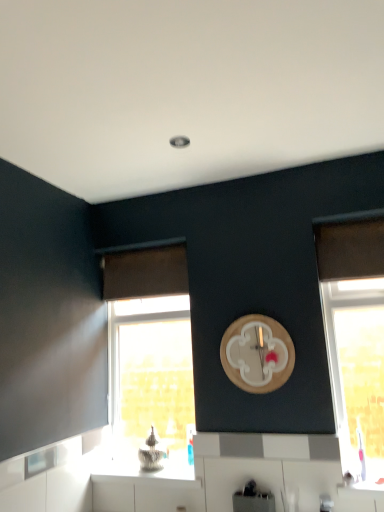
The width and height of the screenshot is (384, 512). Describe the element at coordinates (257, 354) in the screenshot. I see `wooden clock at upper center` at that location.

Image resolution: width=384 pixels, height=512 pixels. Describe the element at coordinates (145, 272) in the screenshot. I see `brown fabric curtain at upper left` at that location.

The height and width of the screenshot is (512, 384). Describe the element at coordinates (142, 473) in the screenshot. I see `white glossy countertop at lower center` at that location.

You are a GUI agent. You are given a task and a screenshot of the screen. Output one action in this format:
    pyautogui.click(x=<x>, y=<y>)
    Task: Click on the clear glass window at lower left, positioned as the first window in left-to-right order
    
    Given the screenshot: What is the action you would take?
    pyautogui.click(x=150, y=354)

This screenshot has width=384, height=512. Describe the element at coordinates (150, 354) in the screenshot. I see `clear glass window at lower left, which appears as the second window when viewed from the right` at that location.

Locate an element on the screen. This screenshot has height=512, width=384. translucent glass window at right, the 1th window in the front-to-back sequence is located at coordinates (355, 342).

Which object is wider, brown fabric curtain at upper left or wooden clock at upper center?

brown fabric curtain at upper left is wider.

How many degrees apart are the facing directions of brown fabric curtain at upper left and wooden clock at upper center?

They differ by 0.329 degrees in their facing directions.

Does brown fabric curtain at upper left appear on the right side of wooden clock at upper center?

No, brown fabric curtain at upper left is not to the right of wooden clock at upper center.

Is brown fabric curtain at upper left next to wooden clock at upper center and touching it?

No, brown fabric curtain at upper left is not next to wooden clock at upper center.

Is white glossy countertop at lower center bigger than metallic silver toaster at lower center?

Yes, white glossy countertop at lower center is bigger than metallic silver toaster at lower center.

Between white glossy countertop at lower center and metallic silver toaster at lower center, which one has larger width?

Wider between the two is white glossy countertop at lower center.

In terms of height, does white glossy countertop at lower center look taller or shorter compared to metallic silver toaster at lower center?

Clearly, white glossy countertop at lower center is shorter compared to metallic silver toaster at lower center.

From the image's perspective, is white glossy countertop at lower center located beneath metallic silver toaster at lower center?

Yes, from the image's perspective, white glossy countertop at lower center is below metallic silver toaster at lower center.

Considering the positions of point (358, 318) and point (167, 471), is point (358, 318) closer or farther from the camera than point (167, 471)?

Point (358, 318) is positioned closer to the camera compared to point (167, 471).

Which object is thinner, translucent glass window at right, the 1th window in the front-to-back sequence, or white glossy countertop at lower center?

With smaller width is translucent glass window at right, the 1th window in the front-to-back sequence.

Would you consider translucent glass window at right, acting as the 2th window starting from the back, to be distant from white glossy countertop at lower center?

Yes, translucent glass window at right, acting as the 2th window starting from the back, and white glossy countertop at lower center are located far from each other.

Who is bigger, translucent glass window at right, acting as the 2th window starting from the back, or white glossy countertop at lower center?

translucent glass window at right, acting as the 2th window starting from the back.

Between clear glass window at lower left, the second window positioned from the front, and metallic silver toaster at lower center, which one has larger size?

clear glass window at lower left, the second window positioned from the front, is bigger.

Considering the relative sizes of clear glass window at lower left, the second window positioned from the front, and metallic silver toaster at lower center in the image provided, is clear glass window at lower left, the second window positioned from the front, wider than metallic silver toaster at lower center?

No, clear glass window at lower left, the second window positioned from the front, is not wider than metallic silver toaster at lower center.

From a real-world perspective, is clear glass window at lower left, which appears as the second window when viewed from the right, below metallic silver toaster at lower center?

Incorrect, from a real-world perspective, clear glass window at lower left, which appears as the second window when viewed from the right, is higher than metallic silver toaster at lower center.

Is clear glass window at lower left, positioned as the first window in left-to-right order, looking in the opposite direction of metallic silver toaster at lower center?

That's not correct — clear glass window at lower left, positioned as the first window in left-to-right order, is not looking away from metallic silver toaster at lower center.

Is clear glass window at lower left, marked as the first window in a back-to-front arrangement, oriented away from brown fabric curtain at upper left?

No.

Between clear glass window at lower left, the second window positioned from the front, and brown fabric curtain at upper left, which one has smaller width?

Thinner between the two is brown fabric curtain at upper left.

Can you confirm if clear glass window at lower left, marked as the first window in a back-to-front arrangement, is positioned to the right of brown fabric curtain at upper left?

Yes.

Considering the sizes of clear glass window at lower left, positioned as the first window in left-to-right order, and brown fabric curtain at upper left in the image, is clear glass window at lower left, positioned as the first window in left-to-right order, taller or shorter than brown fabric curtain at upper left?

→ Clearly, clear glass window at lower left, positioned as the first window in left-to-right order, is taller compared to brown fabric curtain at upper left.

From the picture: From the image's perspective, is white glossy countertop at lower center located beneath translucent glass window at right, the first window in the right-to-left sequence?

Yes.

Identify the location of counter top on the left side of translucent glass window at right, acting as the 2th window starting from the back. The image size is (384, 512). (142, 473).

Is white glossy countertop at lower center facing towards translucent glass window at right, acting as the 2th window starting from the back?

No, white glossy countertop at lower center is not oriented towards translucent glass window at right, acting as the 2th window starting from the back.

There is a translucent glass window at right, the 1th window in the front-to-back sequence. Identify the location of curtain above it (from a real-world perspective). [x=145, y=272].

Which of these two, brown fabric curtain at upper left or translucent glass window at right, the 1th window in the front-to-back sequence, is wider?

translucent glass window at right, the 1th window in the front-to-back sequence.

How different are the orientations of brown fabric curtain at upper left and translucent glass window at right, the second window in the left-to-right sequence, in degrees?

The facing directions of brown fabric curtain at upper left and translucent glass window at right, the second window in the left-to-right sequence, are 0.328 degrees apart.

I want to click on clock below the brown fabric curtain at upper left (from the image's perspective), so (x=257, y=354).

I want to click on appliance above the white glossy countertop at lower center (from the image's perspective), so click(x=253, y=499).

From the image, which object appears to be farther from wooden clock at upper center, metallic silver toaster at lower center or translucent glass window at right, the 1th window in the front-to-back sequence?

The object further to wooden clock at upper center is metallic silver toaster at lower center.

Based on the photo, based on their spatial positions, is wooden clock at upper center or clear glass window at lower left, which appears as the second window when viewed from the right, further from brown fabric curtain at upper left?

wooden clock at upper center is positioned further to the anchor brown fabric curtain at upper left.

Estimate the real-world distances between objects in this image. Which object is closer to clear glass window at lower left, marked as the first window in a back-to-front arrangement, translucent glass window at right, the 1th window in the front-to-back sequence, or wooden clock at upper center?

Among the two, wooden clock at upper center is located nearer to clear glass window at lower left, marked as the first window in a back-to-front arrangement.

Based on their spatial positions, is metallic silver toaster at lower center or clear glass window at lower left, which appears as the second window when viewed from the right, closer to white glossy countertop at lower center?

The object closer to white glossy countertop at lower center is metallic silver toaster at lower center.

Looking at the image, which one is located further to clear glass window at lower left, marked as the first window in a back-to-front arrangement, metallic silver toaster at lower center or translucent glass window at right, the second window in the left-to-right sequence?

Based on the image, metallic silver toaster at lower center appears to be further to clear glass window at lower left, marked as the first window in a back-to-front arrangement.

From the image, which object appears to be nearer to translucent glass window at right, the 1th window in the front-to-back sequence, white glossy countertop at lower center or brown fabric curtain at upper left?

brown fabric curtain at upper left is positioned closer to the anchor translucent glass window at right, the 1th window in the front-to-back sequence.

Looking at the image, which one is located further to clear glass window at lower left, positioned as the first window in left-to-right order, brown fabric curtain at upper left or wooden clock at upper center?

The object further to clear glass window at lower left, positioned as the first window in left-to-right order, is brown fabric curtain at upper left.

Estimate the real-world distances between objects in this image. Which object is closer to white glossy countertop at lower center, clear glass window at lower left, the second window positioned from the front, or brown fabric curtain at upper left?

brown fabric curtain at upper left lies closer to white glossy countertop at lower center than the other object.

Locate an element on the screen. clock between brown fabric curtain at upper left and translucent glass window at right, the first window in the right-to-left sequence is located at coordinates (257, 354).

I want to click on window between brown fabric curtain at upper left and wooden clock at upper center in the horizontal direction, so click(x=150, y=354).

At what (x,y) coordinates should I click in order to perform the action: click on appliance located between white glossy countertop at lower center and translucent glass window at right, the 1th window in the front-to-back sequence, in the left-right direction. Please return your answer as a coordinate pair (x, y). Looking at the image, I should click on (253, 499).

Locate an element on the screen. The image size is (384, 512). clock located between clear glass window at lower left, which appears as the second window when viewed from the right, and translucent glass window at right, the first window in the right-to-left sequence, in the left-right direction is located at coordinates (257, 354).